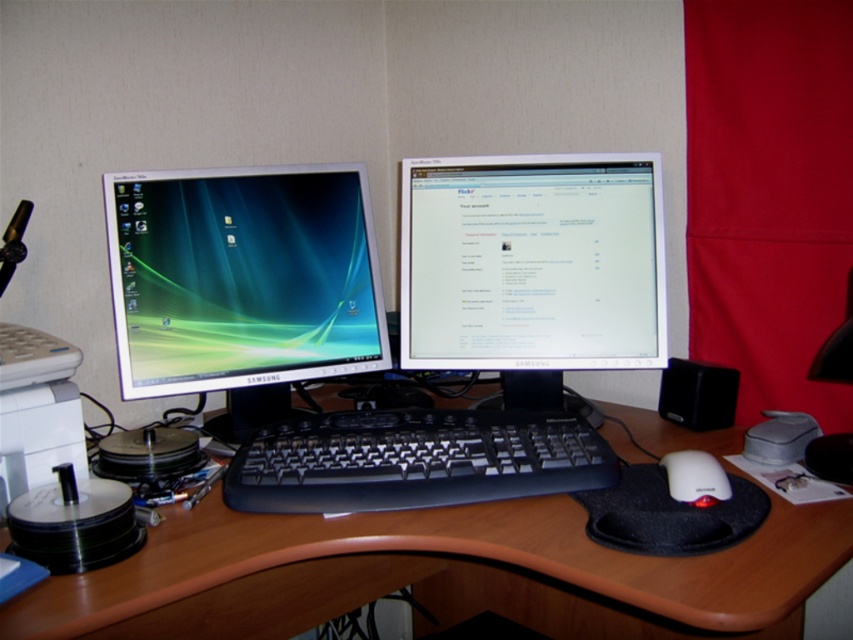
Question: Which point is farther to the camera?

Choices:
 (A) (669, 483)
 (B) (552, 321)
 (C) (189, 376)

Answer: (B)

Question: Which is farther from the white matte mouse at lower right?

Choices:
 (A) brown wood computer desk at center
 (B) matte plastic monitor at left

Answer: (B)

Question: Does brown wood computer desk at center have a smaller size compared to white matte mouse at lower right?

Choices:
 (A) yes
 (B) no

Answer: (B)

Question: Where is matte plastic monitor at left located in relation to white matte mouse at lower right in the image?

Choices:
 (A) above
 (B) below

Answer: (A)

Question: Considering the real-world distances, which object is closest to the black plastic keyboard at center?

Choices:
 (A) white matte mouse at lower right
 (B) brown wood computer desk at center

Answer: (B)

Question: Is brown wood computer desk at center above white matte mouse at lower right?

Choices:
 (A) no
 (B) yes

Answer: (A)